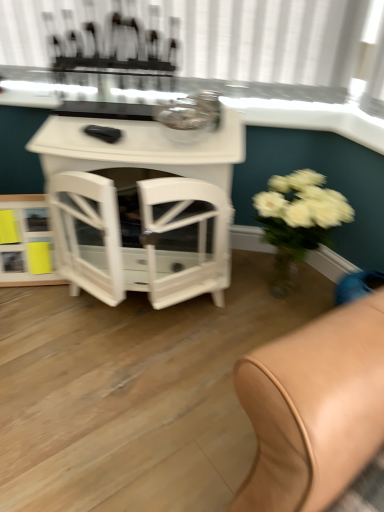
Where is `free spot above white glossy table at center (from a real-world perspective)`? free spot above white glossy table at center (from a real-world perspective) is located at coordinates (133, 133).